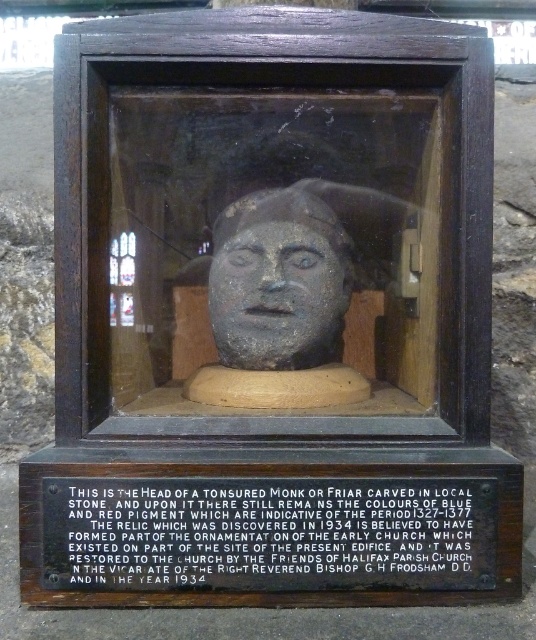
You are an art conservator standing 5 feet away from the stone head. You need to reach the black wood plaque at lower center to secure it. Can you reach it without moving closer?

The black wood plaque at lower center is 3.59 feet away from camera, so if you are standing 5 feet away from the stone head, you are farther than the required distance. You need to move closer to reach it.

You are an art conservator examining the carved stone head. You need to place a protective label on the black wood plaque at lower center. Where exactly should you place the label?

The black wood plaque at lower center should be placed at point coordinates of (265, 531).

You are an art conservator examining the carved stone head and its wooden frame. You need to clean both the black wood plaque at lower center and the matte stone head at center. Which object should you clean first if you want to start with the one that is nearest to you?

The black wood plaque at lower center is closer to the viewer than the matte stone head at center, so you should clean the black wood plaque at lower center first.